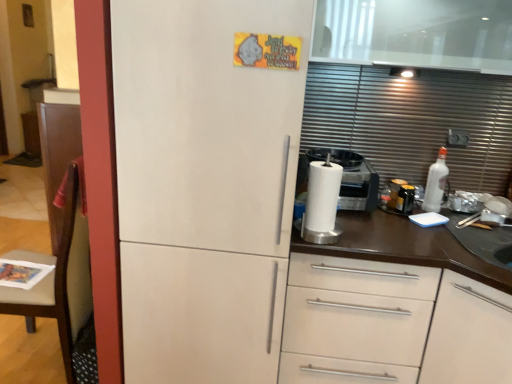
Question: From a real-world perspective, is white matte refrigerator at center under brown wood chair at left?

Choices:
 (A) yes
 (B) no

Answer: (B)

Question: Is white matte refrigerator at center smaller than brown wood chair at left?

Choices:
 (A) no
 (B) yes

Answer: (A)

Question: Is white matte refrigerator at center closer to the viewer compared to brown wood chair at left?

Choices:
 (A) no
 (B) yes

Answer: (B)

Question: Considering the relative sizes of white matte refrigerator at center and brown wood chair at left in the image provided, is white matte refrigerator at center bigger than brown wood chair at left?

Choices:
 (A) no
 (B) yes

Answer: (B)

Question: Is white matte refrigerator at center oriented away from brown wood chair at left?

Choices:
 (A) yes
 (B) no

Answer: (B)

Question: Can you confirm if white matte refrigerator at center is positioned to the right of brown wood chair at left?

Choices:
 (A) no
 (B) yes

Answer: (B)

Question: From a real-world perspective, is brown wood chair at left located higher than white matte cabinet at center?

Choices:
 (A) no
 (B) yes

Answer: (B)

Question: Can you confirm if brown wood chair at left is positioned to the left of white matte cabinet at center?

Choices:
 (A) yes
 (B) no

Answer: (A)

Question: Is brown wood chair at left not near white matte cabinet at center?

Choices:
 (A) yes
 (B) no

Answer: (A)

Question: Considering the relative sizes of brown wood chair at left and white matte cabinet at center in the image provided, is brown wood chair at left wider than white matte cabinet at center?

Choices:
 (A) yes
 (B) no

Answer: (A)

Question: Is brown wood chair at left closer to camera compared to white matte cabinet at center?

Choices:
 (A) no
 (B) yes

Answer: (A)

Question: Does brown wood chair at left have a smaller size compared to white matte cabinet at center?

Choices:
 (A) no
 (B) yes

Answer: (A)

Question: Considering the relative sizes of white matte refrigerator at center and white matte cabinet at center in the image provided, is white matte refrigerator at center smaller than white matte cabinet at center?

Choices:
 (A) no
 (B) yes

Answer: (A)